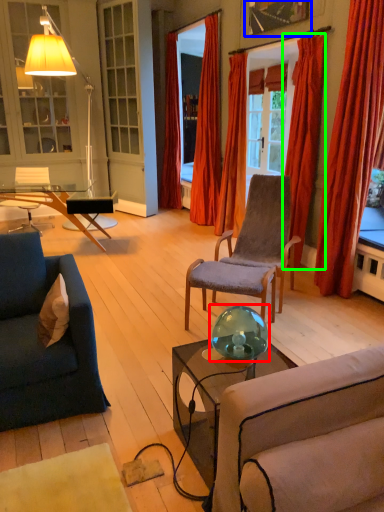
Question: Which object is positioned farthest from teal (highlighted by a red box)? Select from picture frame (highlighted by a blue box) and curtain (highlighted by a green box).

Choices:
 (A) picture frame
 (B) curtain

Answer: (A)